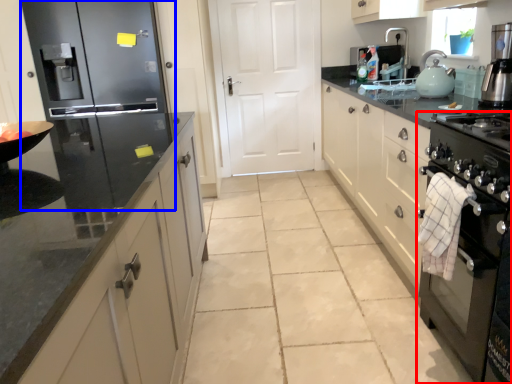
Question: Which object is closer to the camera taking this photo, home appliance (highlighted by a red box) or refrigerator (highlighted by a blue box)?

Choices:
 (A) home appliance
 (B) refrigerator

Answer: (A)